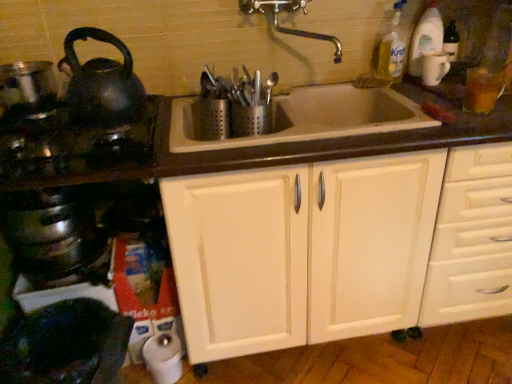
Question: Can we say shiny black kettle at left lies outside shiny black kettle at left?

Choices:
 (A) yes
 (B) no

Answer: (A)

Question: From the image's perspective, would you say shiny black kettle at left is positioned over shiny black kettle at left?

Choices:
 (A) no
 (B) yes

Answer: (B)

Question: Does shiny black kettle at left turn towards shiny black kettle at left?

Choices:
 (A) yes
 (B) no

Answer: (B)

Question: Considering the relative sizes of shiny black kettle at left and shiny black kettle at left in the image provided, is shiny black kettle at left smaller than shiny black kettle at left?

Choices:
 (A) no
 (B) yes

Answer: (B)

Question: Is shiny black kettle at left wider than shiny black kettle at left?

Choices:
 (A) no
 (B) yes

Answer: (A)

Question: From a real-world perspective, is shiny black kettle at left positioned under shiny black kettle at left based on gravity?

Choices:
 (A) yes
 (B) no

Answer: (B)

Question: Is brass metallic faucet at upper center positioned beyond the bounds of shiny black kettle at left?

Choices:
 (A) no
 (B) yes

Answer: (B)

Question: From the image's perspective, is brass metallic faucet at upper center over shiny black kettle at left?

Choices:
 (A) yes
 (B) no

Answer: (A)

Question: Is brass metallic faucet at upper center wider than shiny black kettle at left?

Choices:
 (A) yes
 (B) no

Answer: (B)

Question: Is brass metallic faucet at upper center placed right next to shiny black kettle at left?

Choices:
 (A) yes
 (B) no

Answer: (B)

Question: From a real-world perspective, is brass metallic faucet at upper center on shiny black kettle at left?

Choices:
 (A) yes
 (B) no

Answer: (A)

Question: Does brass metallic faucet at upper center come in front of shiny black kettle at left?

Choices:
 (A) yes
 (B) no

Answer: (B)

Question: From a real-world perspective, does shiny metallic crock pot at lower left stand above white wood cabinet at center?

Choices:
 (A) no
 (B) yes

Answer: (B)